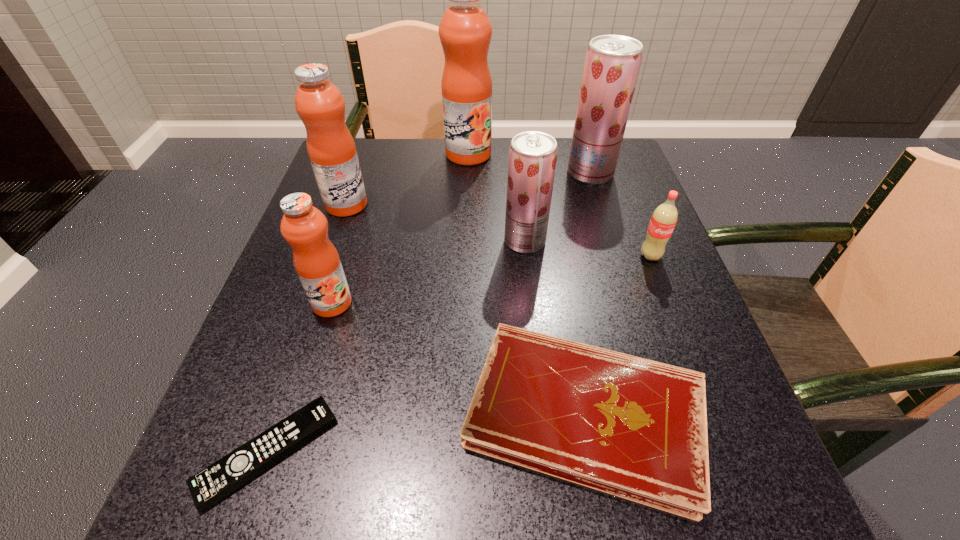
At what (x,y) coordinates should I click in order to perform the action: click on the third shortest object. Please return your answer as a coordinate pair (x, y). Looking at the image, I should click on (664, 218).

In order to click on soda in this screenshot , I will do `click(664, 218)`.

Image resolution: width=960 pixels, height=540 pixels. In order to click on the seventh tallest object in this screenshot , I will do `click(634, 428)`.

In order to click on the shortest object in this screenshot , I will do `click(221, 478)`.

Find the location of a particular element. This screenshot has width=960, height=540. vacant space situated 0.170m on the front label of the farthest orange fruit juice is located at coordinates (467, 208).

You are a GUI agent. You are given a task and a screenshot of the screen. Output one action in this format:
    pyautogui.click(x=<x>, y=<y>)
    Task: Click on the free space located on the front of the bigger strawberry fruit juice
    The width and height of the screenshot is (960, 540).
    Given the screenshot: What is the action you would take?
    pyautogui.click(x=614, y=248)

Locate an element on the screen. vacant area situated on the front label of the second nearest orange fruit juice is located at coordinates (420, 205).

This screenshot has height=540, width=960. I want to click on vacant region located on the back of the fourth fruit juice from left to right, so click(x=516, y=164).

This screenshot has width=960, height=540. Identify the location of free space located on the front label of the nearest fruit juice. (294, 428).

Locate an element on the screen. The image size is (960, 540). blank space located 0.160m on the back of the red soda is located at coordinates (629, 201).